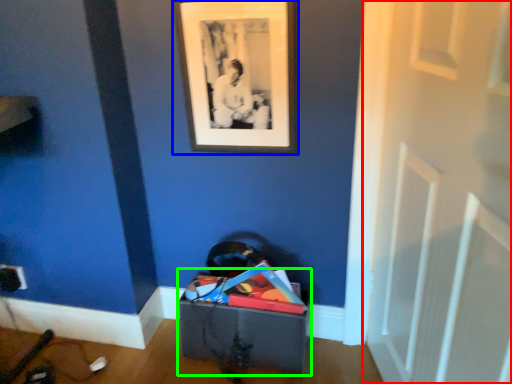
Question: Which is farther away from door (highlighted by a red box)? picture frame (highlighted by a blue box) or storage box (highlighted by a green box)?

Choices:
 (A) picture frame
 (B) storage box

Answer: (B)